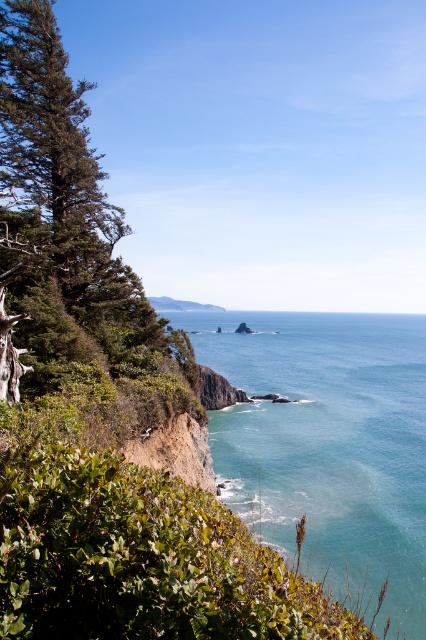
Is clear blue water at center thinner than green leafy tree at left?

No.

What are the coordinates of `clear blue water at center` in the screenshot? It's located at [x=327, y=444].